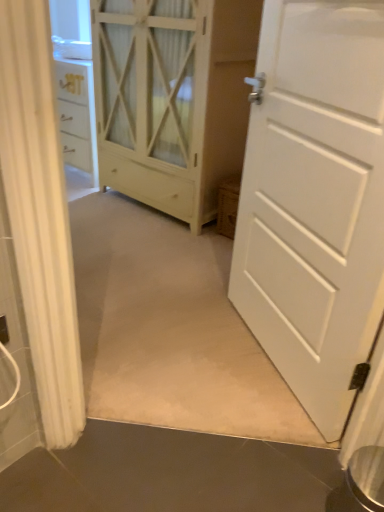
I want to click on vacant space in front of white matte door at right, so click(x=243, y=426).